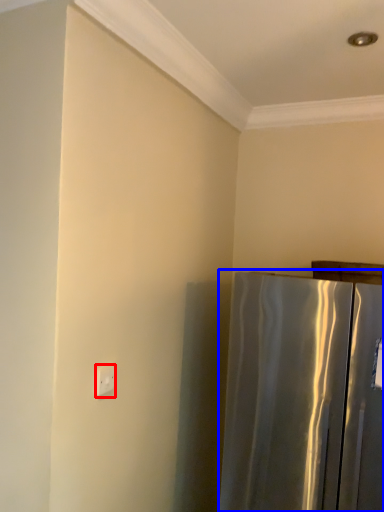
Question: Which point is closer to the camera, electric outlet (highlighted by a red box) or refrigerator (highlighted by a blue box)?

Choices:
 (A) electric outlet
 (B) refrigerator

Answer: (B)